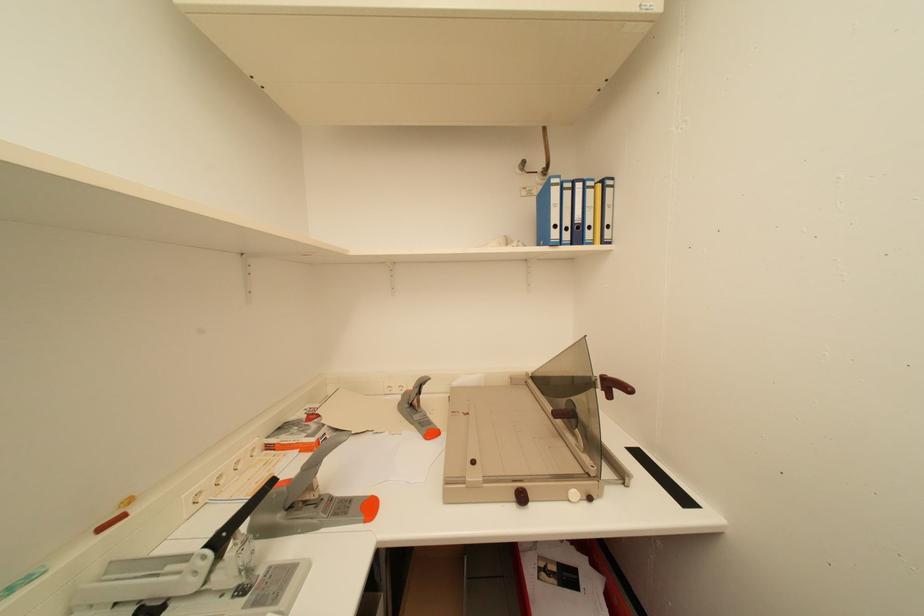
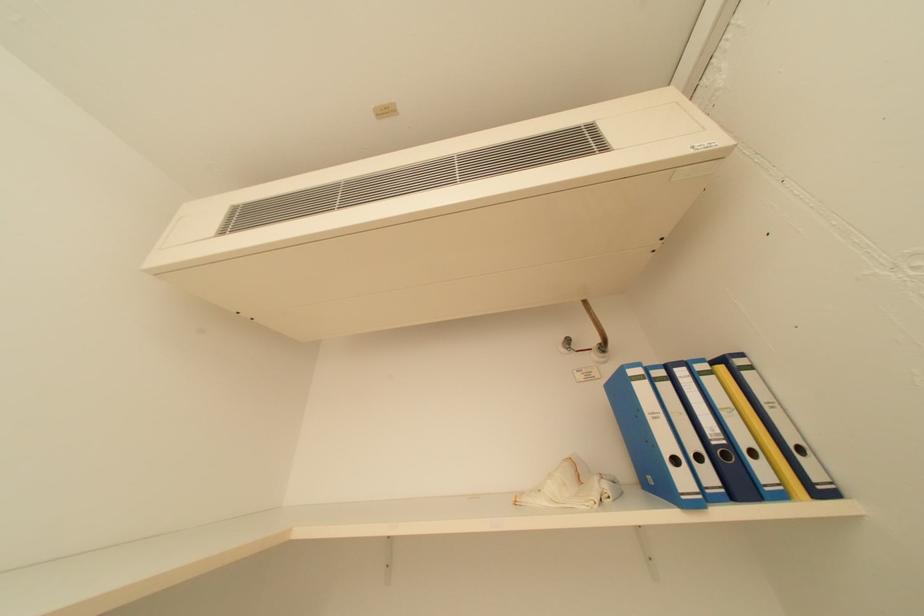
Question: Based on the continuous images, in which direction is the camera rotating? Reply with the corresponding letter.

Choices:
 (A) Left
 (B) Right
 (C) Up
 (D) Down

Answer: (C)